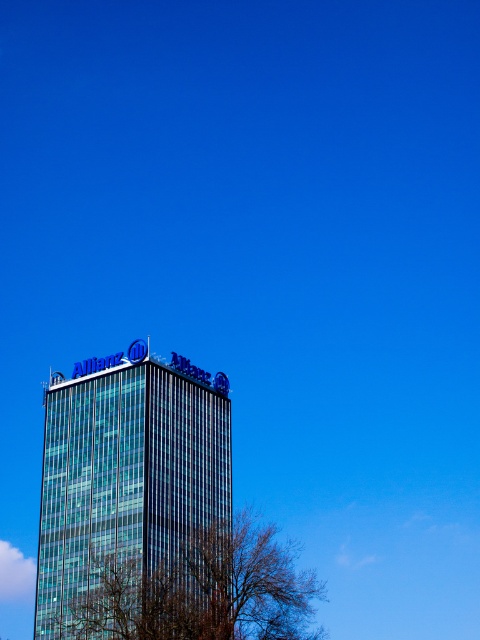
You are standing in front of the building and want to take a photo of the Allianz signs. Which object in the scene is closer to you, the transparent glass building at center or the bare branches at lower center?

The bare branches at lower center are closer to you because the transparent glass building at center is above them, meaning it is farther away.

You are a photographer trying to capture the transparent glass building at center and the bare branches at lower center in the same frame. Based on their widths, which object would appear narrower in the photo?

The transparent glass building at center appears narrower in the photo because it has a lesser width compared to the bare branches at lower center.

You are standing at point (126, 470) in the image. What object is directly in front of you?

The transparent glass building at center is located at point (126, 470), so the object directly in front of you is the transparent glass building at center.